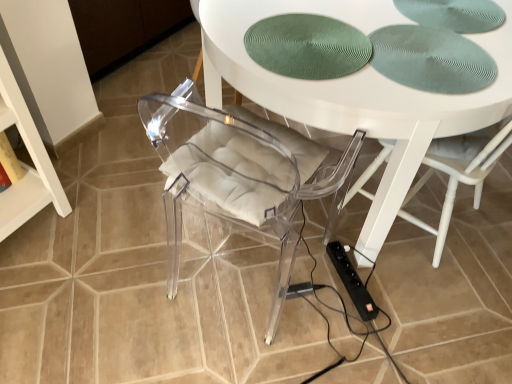
Question: In the image, is white glossy table at center on the left side or the right side of black plastic extension cord at lower right?

Choices:
 (A) left
 (B) right

Answer: (B)

Question: Is white glossy table at center wider or thinner than black plastic extension cord at lower right?

Choices:
 (A) wide
 (B) thin

Answer: (A)

Question: In terms of height, does white glossy table at center look taller or shorter compared to black plastic extension cord at lower right?

Choices:
 (A) tall
 (B) short

Answer: (A)

Question: From the image's perspective, is black plastic extension cord at lower right positioned above or below white glossy table at center?

Choices:
 (A) below
 (B) above

Answer: (A)

Question: Is black plastic extension cord at lower right situated inside white glossy table at center or outside?

Choices:
 (A) inside
 (B) outside

Answer: (A)

Question: In the image, is black plastic extension cord at lower right positioned in front of or behind white glossy table at center?

Choices:
 (A) behind
 (B) front

Answer: (A)

Question: In terms of width, does black plastic extension cord at lower right look wider or thinner when compared to white glossy table at center?

Choices:
 (A) wide
 (B) thin

Answer: (B)